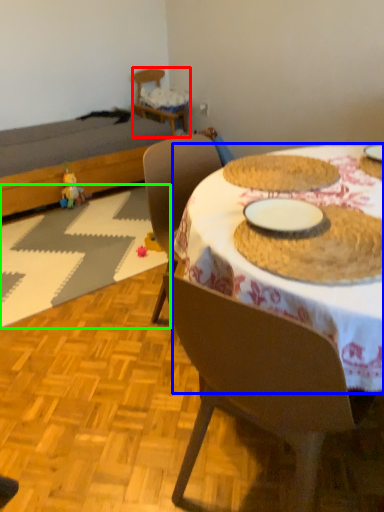
Question: Which object is positioned farthest from chair (highlighted by a red box)? Select from desk (highlighted by a blue box) and place mat (highlighted by a green box).

Choices:
 (A) desk
 (B) place mat

Answer: (A)